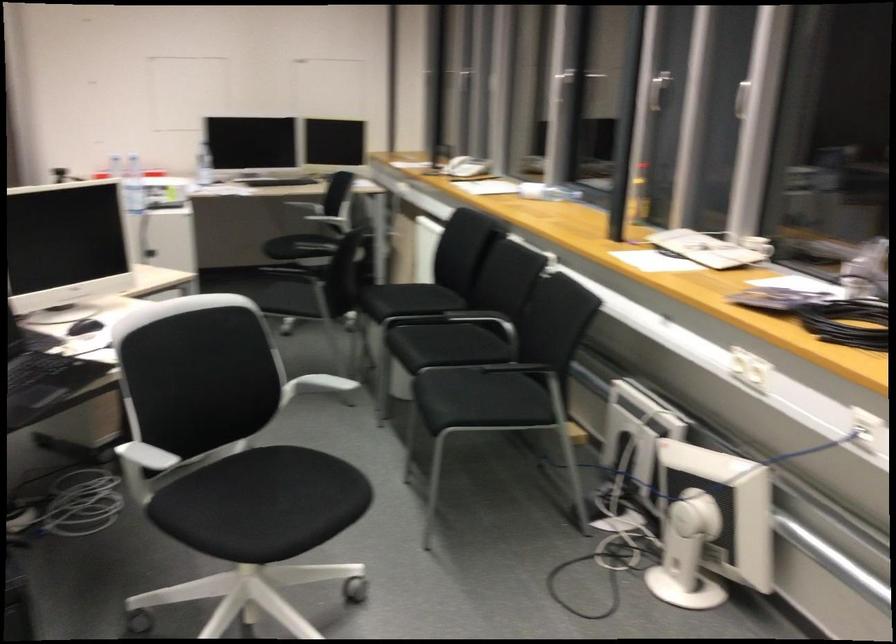
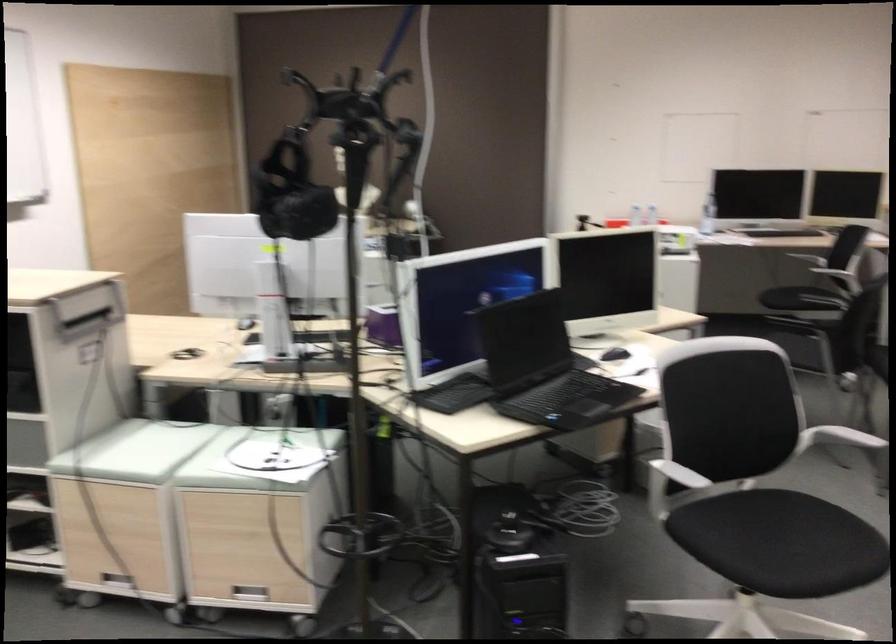
In the second image, find the point that corresponds to (305,386) in the first image.

(840, 437)